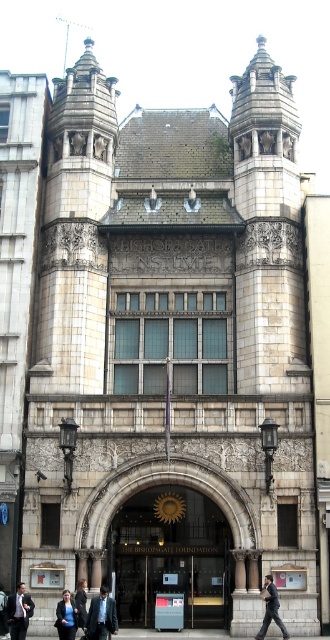
Is dark suit at center taller than dark blue suit at lower left?

Correct, dark suit at center is much taller as dark blue suit at lower left.

Is dark suit at center positioned at the back of dark blue suit at lower left?

Yes, dark suit at center is behind dark blue suit at lower left.

Is point (27, 600) positioned before point (66, 598)?

No, it is behind (66, 598).

The width and height of the screenshot is (330, 640). Identify the location of dark suit at center. (19, 611).

Is dark blue suit at center wider than dark gray suit at center?

Correct, the width of dark blue suit at center exceeds that of dark gray suit at center.

Who is more forward, [104,611] or [267,621]?

Positioned in front is point [104,611].

Is point (90, 632) positioned before point (284, 634)?

Yes, it is in front of point (284, 634).

Identify the location of dark blue suit at center. The height and width of the screenshot is (640, 330). (100, 616).

Can you confirm if dark blue suit at center is positioned above dark suit at center?

Yes.

From the picture: Does dark blue suit at center lie behind dark suit at center?

No.

Who is more forward, (90,618) or (17,634)?

Point (90,618) is in front.

The image size is (330, 640). Find the location of `dark blue suit at center`. dark blue suit at center is located at coordinates (100, 616).